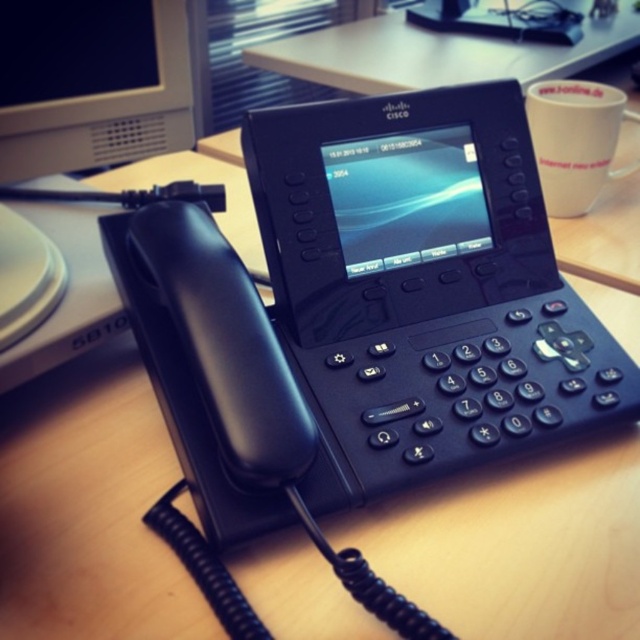
Between wooden table at center and white glossy mug at upper right, which one is positioned lower?

white glossy mug at upper right

Who is more forward, [586,29] or [612,97]?

Point [612,97] is in front.

In order to click on wooden table at center in this screenshot , I will do `click(435, 52)`.